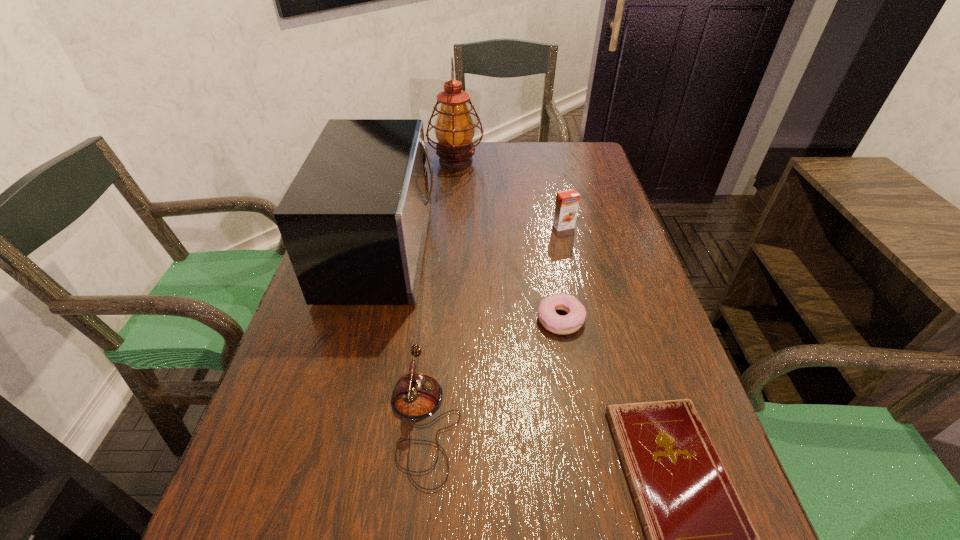
At what (x,y) coordinates should I click in order to perform the action: click on free region that satisfies the following two spatial constraints: 1. on the front side of the orange juice; 2. on the rotary dial of the telephone. Please return your answer as a coordinate pair (x, y). This screenshot has width=960, height=540. Looking at the image, I should click on (610, 424).